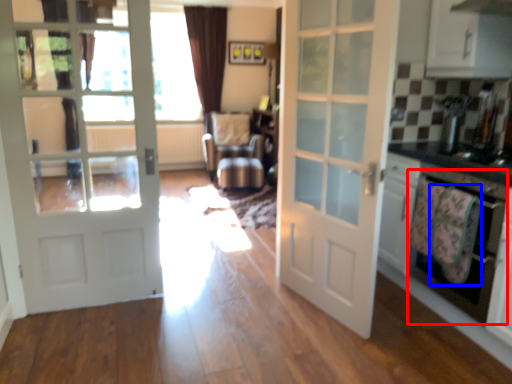
Question: Which of the following is the farthest to the observer, oven (highlighted by a red box) or blanket (highlighted by a blue box)?

Choices:
 (A) oven
 (B) blanket

Answer: (B)